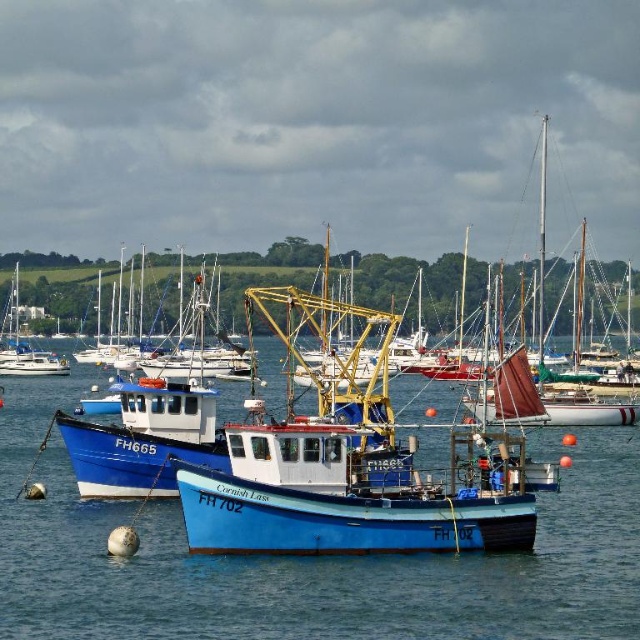
Between blue wooden water at center and blue painted wooden fishing boat at center, which one appears on the left side from the viewer's perspective?

Positioned to the left is blue painted wooden fishing boat at center.

Between blue wooden water at center and blue painted wooden fishing boat at center, which one has less height?

blue wooden water at center is shorter.

Which is behind, point (328, 582) or point (412, 490)?

Positioned behind is point (412, 490).

The image size is (640, 640). In order to click on blue wooden water at center in this screenshot , I will do `click(308, 557)`.